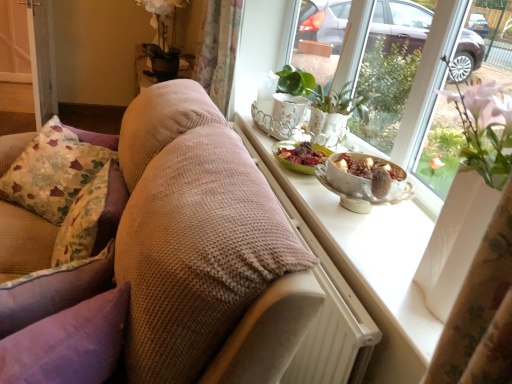
Question: Does metallic silver screen door at left appear on the right side of floral fabric pillow at left, arranged as the first pillow when viewed from the back?

Choices:
 (A) yes
 (B) no

Answer: (B)

Question: Considering the relative sizes of metallic silver screen door at left and floral fabric pillow at left, arranged as the first pillow when viewed from the back, in the image provided, is metallic silver screen door at left wider than floral fabric pillow at left, arranged as the first pillow when viewed from the back,?

Choices:
 (A) yes
 (B) no

Answer: (B)

Question: Considering the relative sizes of metallic silver screen door at left and floral fabric pillow at left, arranged as the first pillow when viewed from the back, in the image provided, is metallic silver screen door at left thinner than floral fabric pillow at left, arranged as the first pillow when viewed from the back,?

Choices:
 (A) no
 (B) yes

Answer: (B)

Question: From a real-world perspective, is metallic silver screen door at left located higher than floral fabric pillow at left, which is counted as the third pillow, starting from the front?

Choices:
 (A) no
 (B) yes

Answer: (A)

Question: Is metallic silver screen door at left in contact with floral fabric pillow at left, arranged as the first pillow when viewed from the back?

Choices:
 (A) no
 (B) yes

Answer: (A)

Question: Is metallic silver screen door at left not close to floral fabric pillow at left, arranged as the first pillow when viewed from the back?

Choices:
 (A) no
 (B) yes

Answer: (B)

Question: Is porcelain bowl with fruit at window sill oriented towards floral fabric cushion at left, which ranks as the second pillow in back-to-front order?

Choices:
 (A) no
 (B) yes

Answer: (A)

Question: Would you say porcelain bowl with fruit at window sill is outside floral fabric cushion at left, placed as the 2th pillow when sorted from front to back?

Choices:
 (A) no
 (B) yes

Answer: (B)

Question: Can you confirm if porcelain bowl with fruit at window sill is thinner than floral fabric cushion at left, which ranks as the second pillow in back-to-front order?

Choices:
 (A) no
 (B) yes

Answer: (A)

Question: Does porcelain bowl with fruit at window sill have a greater height compared to floral fabric cushion at left, placed as the 2th pillow when sorted from front to back?

Choices:
 (A) yes
 (B) no

Answer: (B)

Question: Can you confirm if porcelain bowl with fruit at window sill is positioned to the left of floral fabric cushion at left, placed as the 2th pillow when sorted from front to back?

Choices:
 (A) no
 (B) yes

Answer: (A)

Question: Would you consider porcelain bowl with fruit at window sill to be distant from floral fabric cushion at left, which ranks as the second pillow in back-to-front order?

Choices:
 (A) no
 (B) yes

Answer: (A)

Question: Can you confirm if matte white windowsill at upper right is thinner than floral fabric pillow at left, arranged as the first pillow when viewed from the back?

Choices:
 (A) no
 (B) yes

Answer: (A)